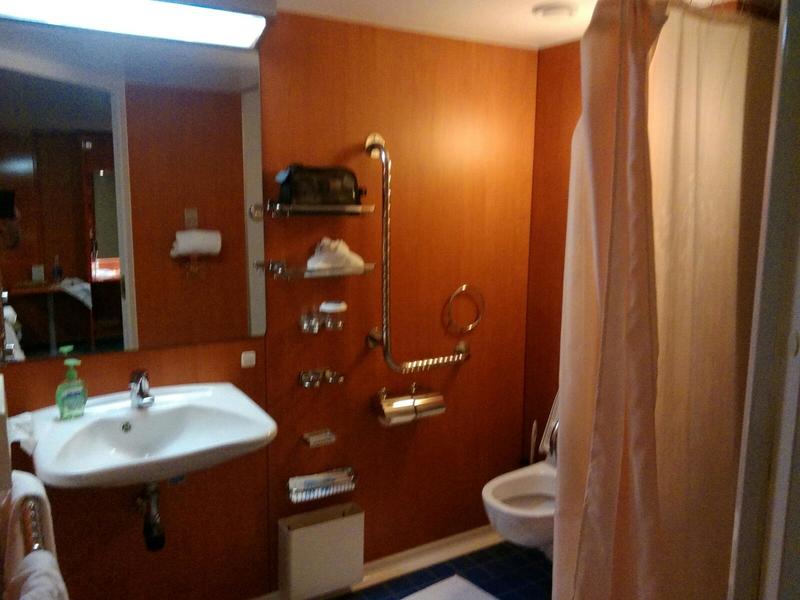
At what (x,y) coordinates should I click in order to perform the action: click on black toiletry bag. Please return your answer as a coordinate pair (x, y). The height and width of the screenshot is (600, 800). Looking at the image, I should click on (316, 183).